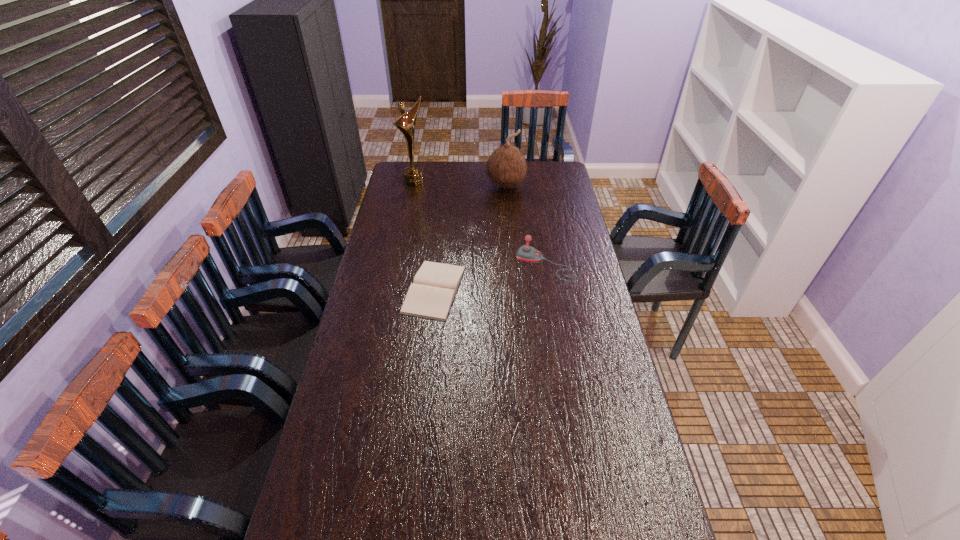
In order to click on vacant space on the desktop that is between the shortest object and the joystick and is positioned on the front-facing side of the award in this screenshot , I will do `click(505, 274)`.

Find the location of `vacant space on the desktop that is between the Bible and the joystick and is positioned on the surface of the coconut`. vacant space on the desktop that is between the Bible and the joystick and is positioned on the surface of the coconut is located at coordinates (492, 277).